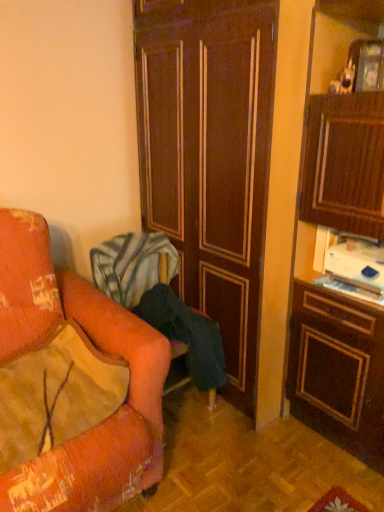
Question: Would you say dark wood door at center contains velvet orange pillow at left?

Choices:
 (A) no
 (B) yes

Answer: (A)

Question: Is dark wood door at center in contact with velvet orange pillow at left?

Choices:
 (A) no
 (B) yes

Answer: (A)

Question: Does dark wood door at center have a greater height compared to velvet orange pillow at left?

Choices:
 (A) yes
 (B) no

Answer: (A)

Question: Is dark wood door at center facing towards velvet orange pillow at left?

Choices:
 (A) yes
 (B) no

Answer: (A)

Question: Can you confirm if dark wood door at center is shorter than velvet orange pillow at left?

Choices:
 (A) no
 (B) yes

Answer: (A)

Question: From a real-world perspective, is velvet orange pillow at left physically located above or below velvet orange chair at left?

Choices:
 (A) above
 (B) below

Answer: (A)

Question: Considering their positions, is velvet orange pillow at left located in front of or behind velvet orange chair at left?

Choices:
 (A) front
 (B) behind

Answer: (A)

Question: From the image's perspective, is velvet orange pillow at left located above or below velvet orange chair at left?

Choices:
 (A) below
 (B) above

Answer: (A)

Question: Would you say velvet orange pillow at left is to the left or to the right of velvet orange chair at left in the picture?

Choices:
 (A) right
 (B) left

Answer: (B)

Question: Considering the positions of velvet orange chair at left and velvet orange pillow at left in the image, is velvet orange chair at left taller or shorter than velvet orange pillow at left?

Choices:
 (A) tall
 (B) short

Answer: (A)

Question: From a real-world perspective, is velvet orange chair at left positioned above or below velvet orange pillow at left?

Choices:
 (A) below
 (B) above

Answer: (A)

Question: From the image's perspective, is velvet orange chair at left positioned above or below velvet orange pillow at left?

Choices:
 (A) above
 (B) below

Answer: (A)

Question: Based on their positions, is velvet orange chair at left located to the left or right of velvet orange pillow at left?

Choices:
 (A) left
 (B) right

Answer: (B)

Question: Is dark wood door at center spatially inside velvet orange pillow at left, or outside of it?

Choices:
 (A) outside
 (B) inside

Answer: (A)

Question: From their relative heights in the image, would you say dark wood door at center is taller or shorter than velvet orange pillow at left?

Choices:
 (A) tall
 (B) short

Answer: (A)